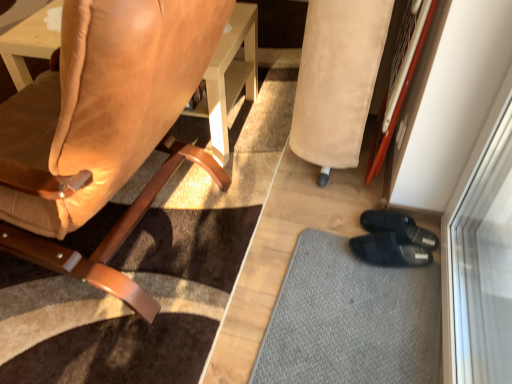
Where is `vacant area that is in front of beige suede bean bag chair at lower right`? vacant area that is in front of beige suede bean bag chair at lower right is located at coordinates (346, 208).